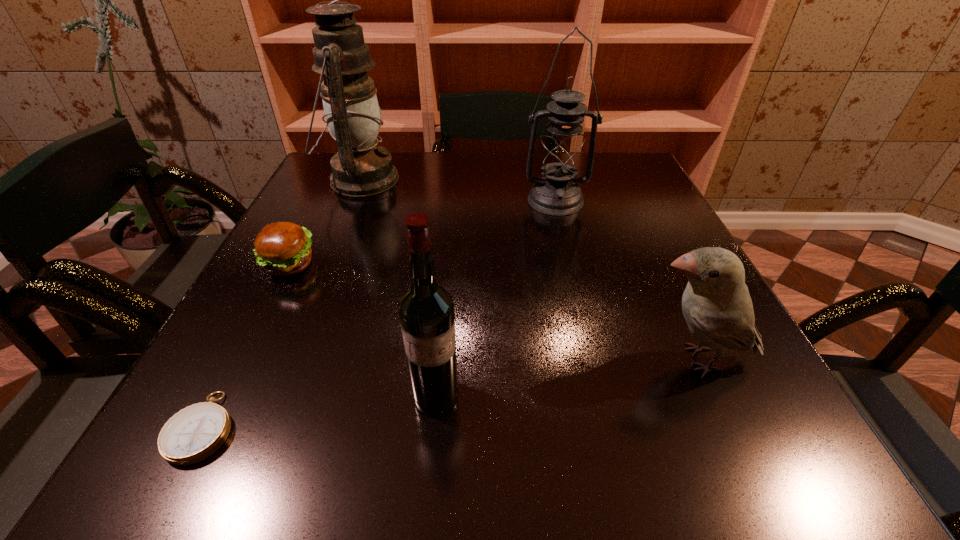
Locate an element on the screen. vacant space that is in between the left oil lamp and the bird is located at coordinates (529, 269).

Find the location of a particular element. free space between the left oil lamp and the shortest object is located at coordinates (282, 303).

The width and height of the screenshot is (960, 540). In order to click on free spot between the third tallest object and the left oil lamp in this screenshot , I will do `click(398, 288)`.

Locate an element on the screen. vacant area that lies between the compass and the third tallest object is located at coordinates (320, 411).

Where is `unoccupied position between the fifth tallest object and the bird`? The width and height of the screenshot is (960, 540). unoccupied position between the fifth tallest object and the bird is located at coordinates (492, 312).

Where is `free space between the left oil lamp and the right oil lamp`? free space between the left oil lamp and the right oil lamp is located at coordinates (458, 190).

Find the location of a particular element. The height and width of the screenshot is (540, 960). vacant area that lies between the third tallest object and the shortest object is located at coordinates (320, 411).

The width and height of the screenshot is (960, 540). I want to click on object that ranks as the third closest to the right oil lamp, so click(284, 248).

This screenshot has height=540, width=960. Find the location of `object that is the fourth closest one to the left oil lamp`. object that is the fourth closest one to the left oil lamp is located at coordinates click(x=193, y=434).

The image size is (960, 540). What are the coordinates of `free spot that satisfies the following two spatial constraints: 1. at the face of the fourth tallest object; 2. on the front side of the compass` in the screenshot? It's located at (728, 427).